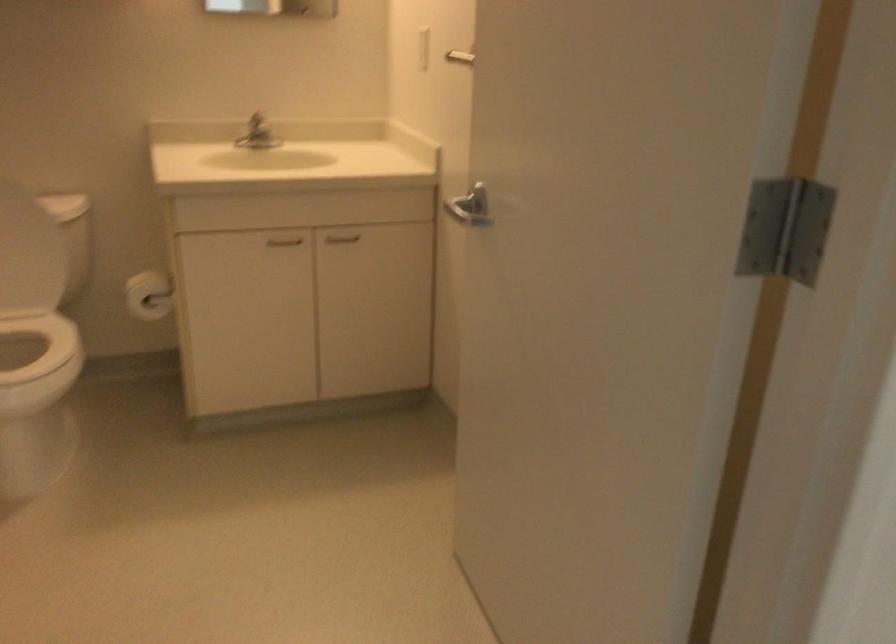
Locate an element on the screen. white toilet seat is located at coordinates (22, 341).